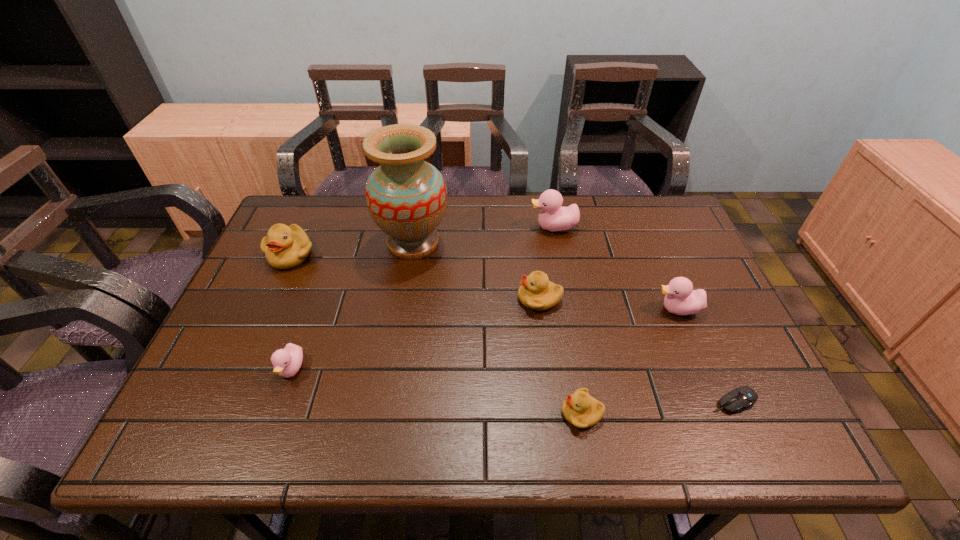
This screenshot has height=540, width=960. In order to click on free spot located 0.340m on the front-facing side of the rightmost duckling in this screenshot , I will do `click(521, 309)`.

In order to click on free region located on the front-facing side of the rightmost duckling in this screenshot , I will do `click(588, 309)`.

What are the coordinates of `vacant space located 0.290m on the front-facing side of the second biggest yellow duckling` in the screenshot? It's located at (407, 299).

The height and width of the screenshot is (540, 960). In order to click on free spot located on the front-facing side of the second biggest yellow duckling in this screenshot , I will do `click(464, 299)`.

At what (x,y) coordinates should I click in order to perform the action: click on vacant space situated on the front-facing side of the second biggest yellow duckling. Please return your answer as a coordinate pair (x, y). Looking at the image, I should click on (468, 299).

Identify the location of free space located on the front-facing side of the seventh object from right to left. (267, 439).

Locate an element on the screen. This screenshot has width=960, height=540. vacant point located on the front-facing side of the nearest yellow duckling is located at coordinates (423, 413).

Locate an element on the screen. The image size is (960, 540). free region located 0.170m on the front-facing side of the nearest yellow duckling is located at coordinates (480, 413).

Where is `vacant space situated on the front-facing side of the nearest yellow duckling`? vacant space situated on the front-facing side of the nearest yellow duckling is located at coordinates (385, 413).

Identify the location of vacant space located on the left of the computer mouse. Image resolution: width=960 pixels, height=540 pixels. (660, 402).